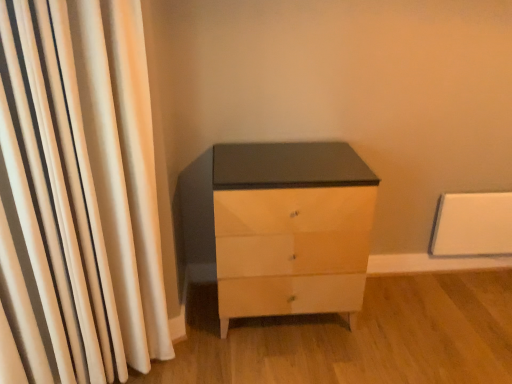
Question: Is white fabric curtain at left at the right side of matte white chest of drawers at center?

Choices:
 (A) no
 (B) yes

Answer: (A)

Question: Does white fabric curtain at left appear on the left side of matte white chest of drawers at center?

Choices:
 (A) no
 (B) yes

Answer: (B)

Question: Considering the relative sizes of white fabric curtain at left and matte white chest of drawers at center in the image provided, is white fabric curtain at left bigger than matte white chest of drawers at center?

Choices:
 (A) yes
 (B) no

Answer: (B)

Question: From a real-world perspective, is white fabric curtain at left below matte white chest of drawers at center?

Choices:
 (A) no
 (B) yes

Answer: (A)

Question: Is white fabric curtain at left not inside matte white chest of drawers at center?

Choices:
 (A) yes
 (B) no

Answer: (A)

Question: Is the surface of white fabric curtain at left in direct contact with matte white chest of drawers at center?

Choices:
 (A) yes
 (B) no

Answer: (B)

Question: Is matte white chest of drawers at center oriented away from white fabric curtain at left?

Choices:
 (A) yes
 (B) no

Answer: (B)

Question: From a real-world perspective, is matte white chest of drawers at center located higher than white fabric curtain at left?

Choices:
 (A) no
 (B) yes

Answer: (A)

Question: From a real-world perspective, is matte white chest of drawers at center beneath white fabric curtain at left?

Choices:
 (A) yes
 (B) no

Answer: (A)

Question: Can you confirm if matte white chest of drawers at center is smaller than white fabric curtain at left?

Choices:
 (A) no
 (B) yes

Answer: (A)

Question: Is matte white chest of drawers at center oriented towards white fabric curtain at left?

Choices:
 (A) no
 (B) yes

Answer: (A)

Question: Is matte white chest of drawers at center closer to the viewer compared to white fabric curtain at left?

Choices:
 (A) yes
 (B) no

Answer: (B)

Question: Would you say matte white chest of drawers at center is to the left or to the right of white fabric curtain at left in the picture?

Choices:
 (A) left
 (B) right

Answer: (B)